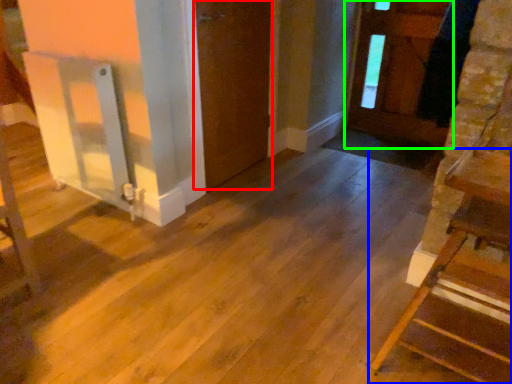
Question: Estimate the real-world distances between objects in this image. Which object is closer to door (highlighted by a red box), furniture (highlighted by a blue box) or door (highlighted by a green box)?

Choices:
 (A) furniture
 (B) door

Answer: (B)